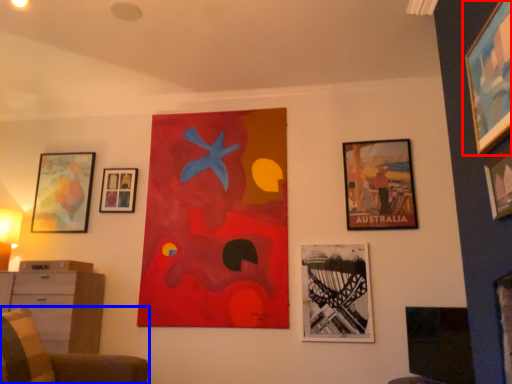
Question: Which of the following is the closest to the observer, picture frame (highlighted by a red box) or furniture (highlighted by a blue box)?

Choices:
 (A) picture frame
 (B) furniture

Answer: (B)